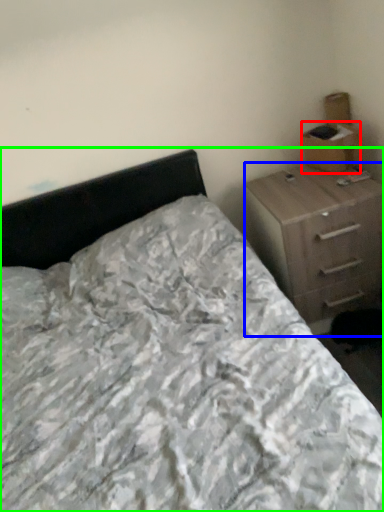
Question: Which object is positioned farthest from cardboard box (highlighted by a red box)? Select from chest of drawers (highlighted by a blue box) and bed (highlighted by a green box).

Choices:
 (A) chest of drawers
 (B) bed

Answer: (B)